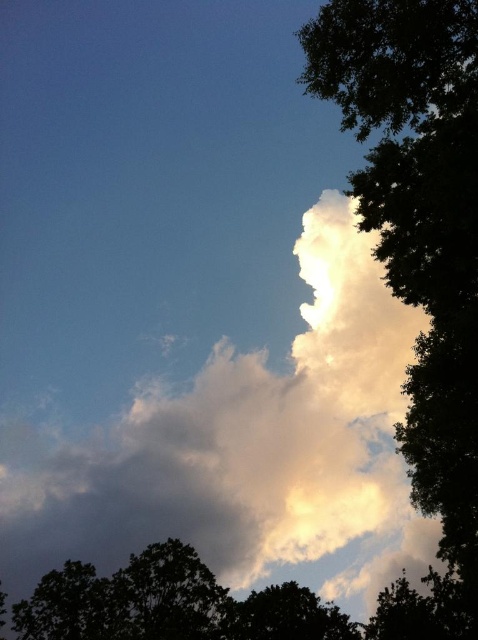
Is green leafy tree at upper right to the left of green leafy tree at lower right from the viewer's perspective?

Incorrect, green leafy tree at upper right is not on the left side of green leafy tree at lower right.

How distant is green leafy tree at upper right from green leafy tree at lower right?

green leafy tree at upper right is 8.29 meters from green leafy tree at lower right.

Image resolution: width=478 pixels, height=640 pixels. In order to click on green leafy tree at upper right in this screenshot , I will do `click(420, 225)`.

This screenshot has width=478, height=640. Identify the location of green leafy tree at upper right. (420, 225).

Is green leafy tree at lower center taller than green leafy tree at lower right?

Yes, green leafy tree at lower center is taller than green leafy tree at lower right.

Does green leafy tree at lower center have a smaller size compared to green leafy tree at lower right?

No, green leafy tree at lower center is not smaller than green leafy tree at lower right.

Is point (455, 595) positioned in front of point (304, 627)?

No, (455, 595) is further to viewer.

Locate an element on the screen. This screenshot has width=478, height=640. green leafy tree at lower center is located at coordinates (228, 605).

Does white fluffy cloud at upper center appear on the right side of green leafy tree at lower center?

Correct, you'll find white fluffy cloud at upper center to the right of green leafy tree at lower center.

Does point (355, 420) lie behind point (456, 579)?

Yes, it is.

Where is `white fluffy cloud at upper center`? The width and height of the screenshot is (478, 640). white fluffy cloud at upper center is located at coordinates (243, 445).